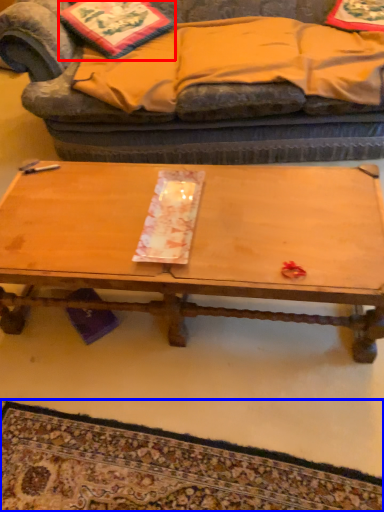
Question: Among these objects, which one is farthest to the camera, pillow (highlighted by a red box) or mat (highlighted by a blue box)?

Choices:
 (A) pillow
 (B) mat

Answer: (A)